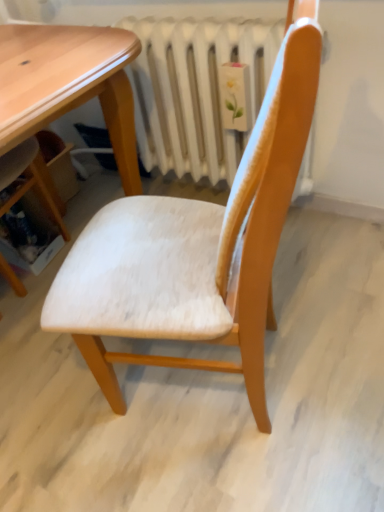
Question: Should I look upward or downward to see white fabric chair at center?

Choices:
 (A) up
 (B) down

Answer: (A)

Question: Can we say white painted metal radiator at center lies outside white fabric chair at center?

Choices:
 (A) yes
 (B) no

Answer: (A)

Question: Are white painted metal radiator at center and white fabric chair at center far apart?

Choices:
 (A) yes
 (B) no

Answer: (B)

Question: Considering the relative positions of white painted metal radiator at center and white fabric chair at center in the image provided, is white painted metal radiator at center to the left of white fabric chair at center from the viewer's perspective?

Choices:
 (A) no
 (B) yes

Answer: (A)

Question: Is white painted metal radiator at center wider than white fabric chair at center?

Choices:
 (A) yes
 (B) no

Answer: (B)

Question: Is white painted metal radiator at center aimed at white fabric chair at center?

Choices:
 (A) no
 (B) yes

Answer: (B)

Question: Does white painted metal radiator at center touch white fabric chair at center?

Choices:
 (A) no
 (B) yes

Answer: (A)

Question: Is white fabric chair at center smaller than white painted metal radiator at center?

Choices:
 (A) yes
 (B) no

Answer: (B)

Question: Is white fabric chair at center beside white painted metal radiator at center?

Choices:
 (A) yes
 (B) no

Answer: (B)

Question: Is white fabric chair at center behind white painted metal radiator at center?

Choices:
 (A) yes
 (B) no

Answer: (B)

Question: Is white fabric chair at center at the right side of white painted metal radiator at center?

Choices:
 (A) no
 (B) yes

Answer: (A)

Question: Does white fabric chair at center have a lesser width compared to white painted metal radiator at center?

Choices:
 (A) no
 (B) yes

Answer: (A)

Question: Is white fabric chair at center aimed at white painted metal radiator at center?

Choices:
 (A) yes
 (B) no

Answer: (B)

Question: In terms of size, does white fabric chair at center appear bigger or smaller than white painted metal radiator at center?

Choices:
 (A) small
 (B) big

Answer: (B)